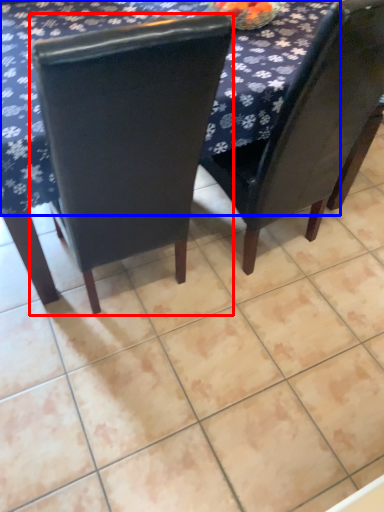
Question: Which object is closer to the camera taking this photo, chair (highlighted by a red box) or tablecloth (highlighted by a blue box)?

Choices:
 (A) chair
 (B) tablecloth

Answer: (A)